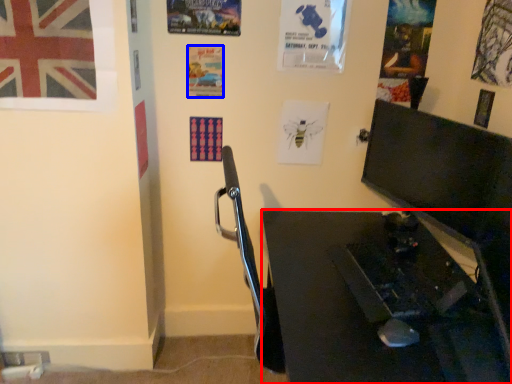
Question: Which of the following is the farthest to the observer, desk (highlighted by a red box) or poster page (highlighted by a blue box)?

Choices:
 (A) desk
 (B) poster page

Answer: (B)